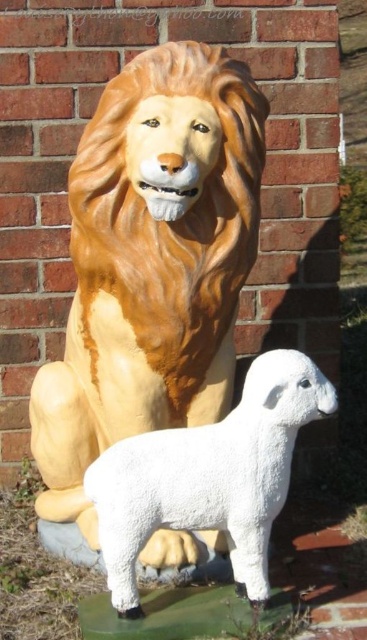
Can you confirm if matte golden lion at center is positioned below white fluffy lamb at lower center?

No, matte golden lion at center is not below white fluffy lamb at lower center.

Can you confirm if matte golden lion at center is wider than white fluffy lamb at lower center?

Yes, matte golden lion at center is wider than white fluffy lamb at lower center.

Find the location of a particular element. The image size is (367, 640). matte golden lion at center is located at coordinates (151, 262).

Identify the location of matte golden lion at center. (151, 262).